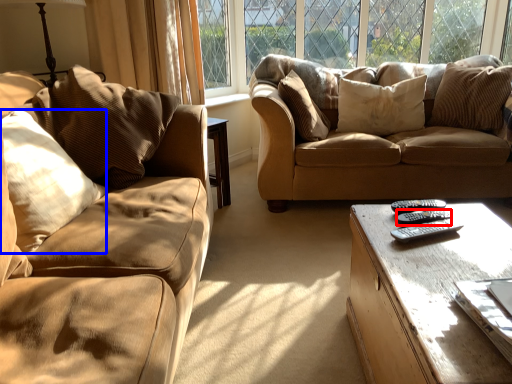
Question: Which object appears closest to the camera in this image, remote (highlighted by a red box) or pillow (highlighted by a blue box)?

Choices:
 (A) remote
 (B) pillow

Answer: (B)